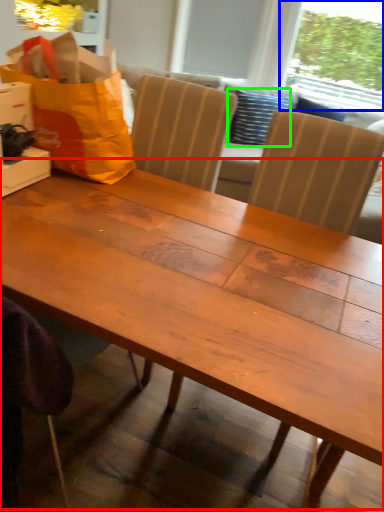
Question: Considering the real-world distances, which object is farthest from table (highlighted by a red box)? window screen (highlighted by a blue box) or pillow (highlighted by a green box)?

Choices:
 (A) window screen
 (B) pillow

Answer: (A)